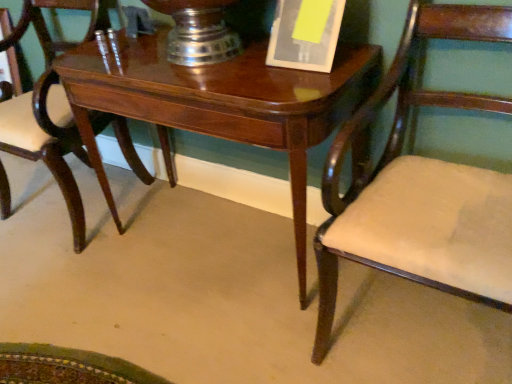
The image size is (512, 384). In order to click on blank space to the left of glossy wood table at center in this screenshot , I will do `click(75, 286)`.